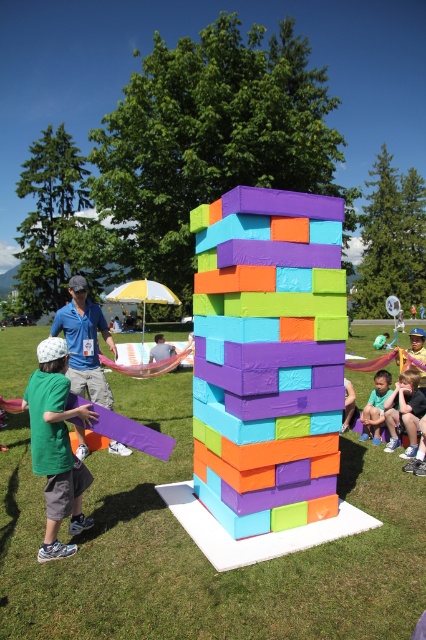
Question: Where is matte foam blocks at center located in relation to matte blue shorts at lower right in the image?

Choices:
 (A) left
 (B) right

Answer: (A)

Question: Is green matte shirt at center smaller than matte blue shirt at center?

Choices:
 (A) yes
 (B) no

Answer: (A)

Question: Is matte plastic blocks at center to the right of matte blue shirt at center from the viewer's perspective?

Choices:
 (A) yes
 (B) no

Answer: (A)

Question: Considering the real-world distances, which object is farthest from the matte foam blocks at center?

Choices:
 (A) light blue fabric at center
 (B) matte blue shorts at lower right
 (C) green matte shirt at center

Answer: (B)

Question: Which point is closer to the camera?

Choices:
 (A) (158, 339)
 (B) (382, 339)
 (C) (172, 577)
 (D) (371, 412)

Answer: (C)

Question: Which of the following is the closest to the observer?

Choices:
 (A) (374, 348)
 (B) (85, 486)

Answer: (B)